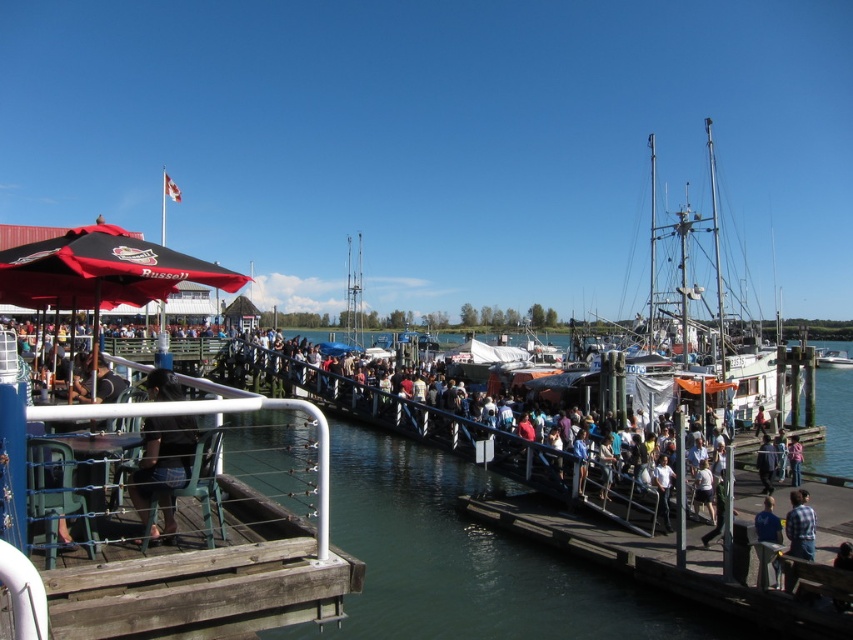
Question: Which object is the closest to the white wooden boat at right?

Choices:
 (A) blue fabric shirt at lower right
 (B) plaid shirt at lower right

Answer: (B)

Question: Is white wooden boat at right to the right of blue fabric shirt at lower right from the viewer's perspective?

Choices:
 (A) yes
 (B) no

Answer: (A)

Question: Which object appears closest to the camera in this image?

Choices:
 (A) blue fabric shirt at center
 (B) white wooden boat at right
 (C) blue fabric shirt at lower right
 (D) dark brown leather jacket at left

Answer: (D)

Question: Can you confirm if plaid shirt at lower right is thinner than blue fabric shirt at lower right?

Choices:
 (A) no
 (B) yes

Answer: (B)

Question: Can you confirm if white wooden boat at right is positioned to the right of blue fabric shirt at lower right?

Choices:
 (A) no
 (B) yes

Answer: (B)

Question: Which is farther from the dark brown leather jacket at left?

Choices:
 (A) blue fabric shirt at lower right
 (B) white wooden boat at right
 (C) blue fabric shirt at center

Answer: (B)